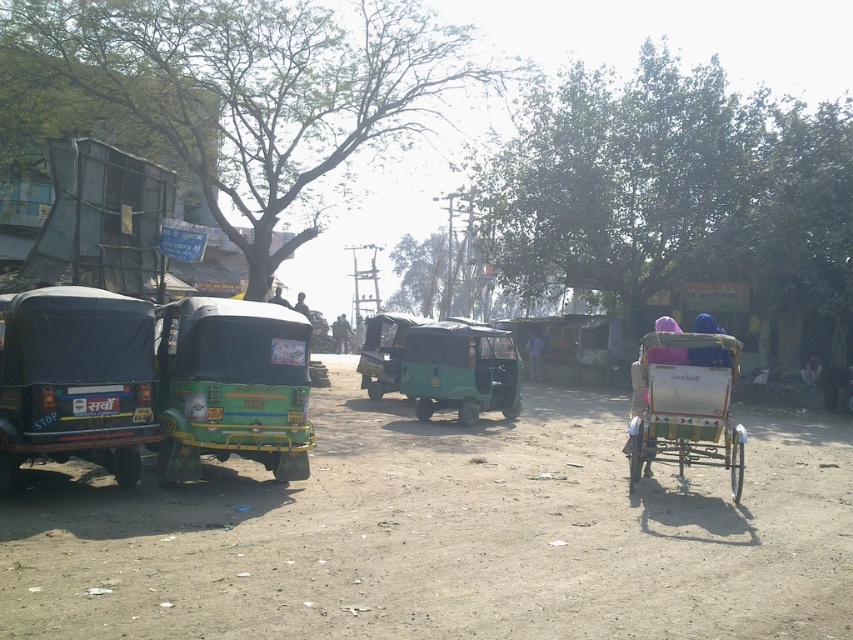
Describe the element at coordinates (683, 406) in the screenshot. Image resolution: width=853 pixels, height=640 pixels. I see `metallic silver rickshaw at center` at that location.

Consider the image. Who is more forward, (706, 365) or (801, 371)?

Point (706, 365) is in front.

At what (x,y) coordinates should I click in order to perform the action: click on metallic silver rickshaw at center. Please return your answer as a coordinate pair (x, y). This screenshot has height=640, width=853. Looking at the image, I should click on (683, 406).

Is metallic silver rickshaw at center shorter than light brown wooden chair at center?

In fact, metallic silver rickshaw at center may be taller than light brown wooden chair at center.

Who is lower down, metallic silver rickshaw at center or light brown wooden chair at center?

metallic silver rickshaw at center is lower down.

Locate an element on the screen. metallic silver rickshaw at center is located at coordinates (683, 406).

Based on the photo, between brown dusty ground at center and light brown wooden cart at center, which one is positioned higher?

Positioned higher is light brown wooden cart at center.

Does brown dusty ground at center lie in front of light brown wooden cart at center?

Yes, brown dusty ground at center is in front of light brown wooden cart at center.

Is point (320, 625) positioned in front of point (802, 368)?

That is True.

Find the location of a particular element. Image resolution: width=853 pixels, height=640 pixels. brown dusty ground at center is located at coordinates (445, 536).